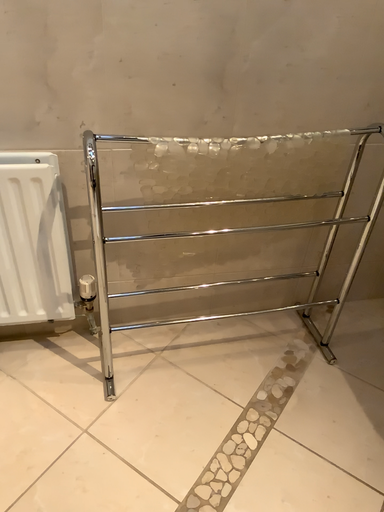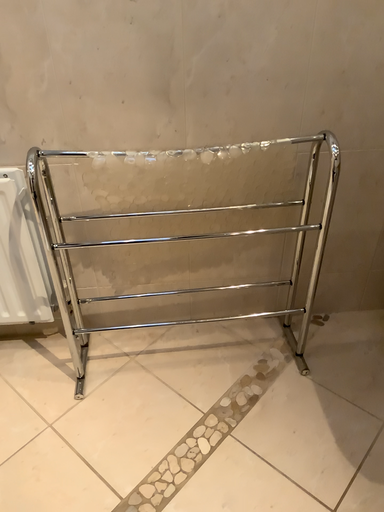
Question: How did the camera likely rotate when shooting the video?

Choices:
 (A) rotated left
 (B) rotated right

Answer: (A)